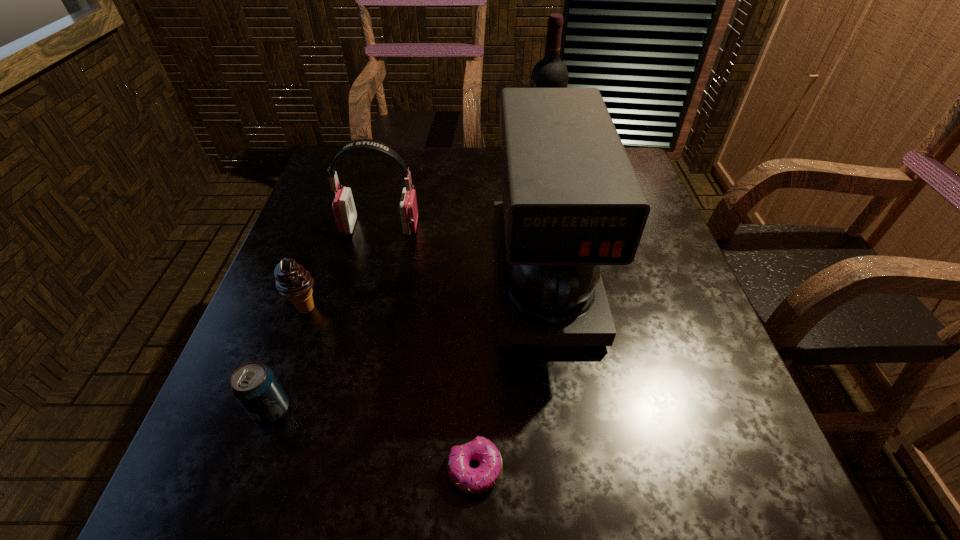
This screenshot has width=960, height=540. Identify the location of wine bottle. (550, 72).

Find the location of a particular element. This screenshot has height=540, width=960. the fifth shortest object is located at coordinates (572, 201).

The height and width of the screenshot is (540, 960). Find the location of `earphone`. earphone is located at coordinates click(343, 206).

Locate an element on the screen. This screenshot has width=960, height=540. the fourth tallest object is located at coordinates (292, 281).

The image size is (960, 540). I want to click on the fifth tallest object, so click(254, 385).

Find the location of `the fifth farthest object`. the fifth farthest object is located at coordinates (254, 385).

This screenshot has height=540, width=960. I want to click on the shortest object, so click(x=469, y=480).

The image size is (960, 540). Find the location of `the third object from right to left`. the third object from right to left is located at coordinates (469, 480).

What are the coordinates of `vacant area located on the label of the wine bottle` in the screenshot? It's located at (420, 158).

The width and height of the screenshot is (960, 540). I want to click on free space located on the label of the wine bottle, so click(407, 158).